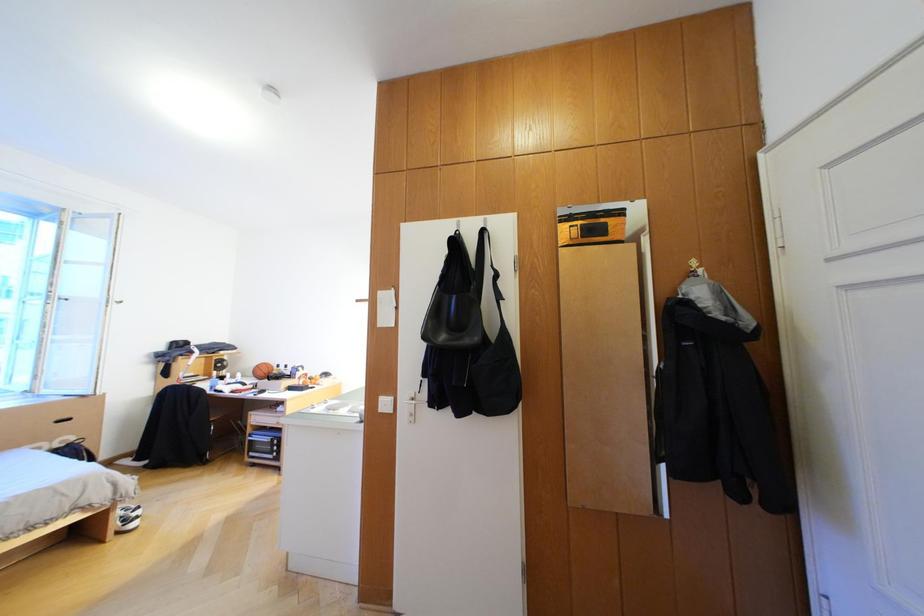
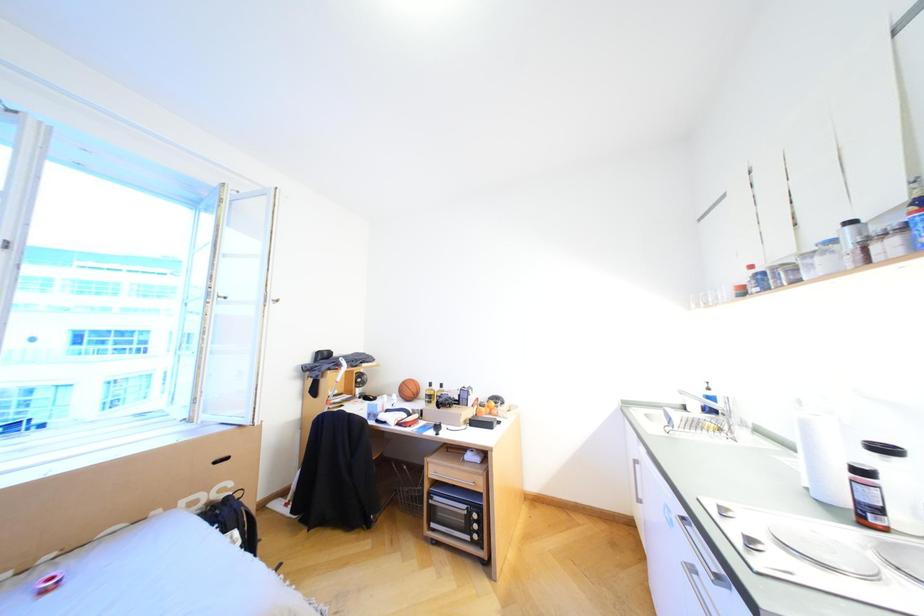
Based on the photo, which direction would the cameraman need to move to produce the second image?

The cameraman walked toward left, forward.